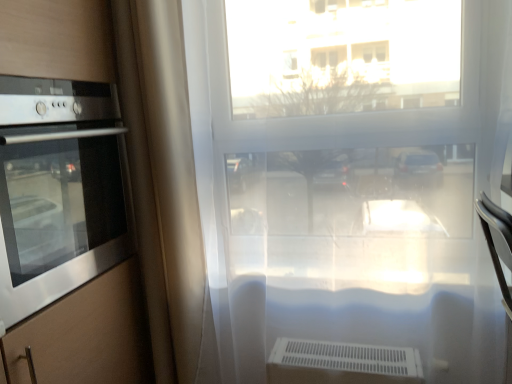
Question: Does beige fabric curtain at left have a greater height compared to stainless steel oven at left?

Choices:
 (A) no
 (B) yes

Answer: (B)

Question: Considering the relative sizes of beige fabric curtain at left and stainless steel oven at left in the image provided, is beige fabric curtain at left bigger than stainless steel oven at left?

Choices:
 (A) no
 (B) yes

Answer: (A)

Question: Is stainless steel oven at left surrounded by beige fabric curtain at left?

Choices:
 (A) no
 (B) yes

Answer: (A)

Question: Is stainless steel oven at left at the back of beige fabric curtain at left?

Choices:
 (A) no
 (B) yes

Answer: (A)

Question: Does beige fabric curtain at left have a greater width compared to stainless steel oven at left?

Choices:
 (A) no
 (B) yes

Answer: (A)

Question: Based on their sizes in the image, would you say transparent plastic window at center is bigger or smaller than beige fabric curtain at left?

Choices:
 (A) small
 (B) big

Answer: (B)

Question: Is point (237, 34) closer or farther from the camera than point (150, 104)?

Choices:
 (A) farther
 (B) closer

Answer: (A)

Question: From the image's perspective, is transparent plastic window at center located above or below beige fabric curtain at left?

Choices:
 (A) above
 (B) below

Answer: (B)

Question: In the image, is transparent plastic window at center positioned in front of or behind beige fabric curtain at left?

Choices:
 (A) front
 (B) behind

Answer: (A)

Question: Looking at the image, does beige fabric curtain at left seem bigger or smaller compared to transparent plastic window at center?

Choices:
 (A) small
 (B) big

Answer: (A)

Question: In the image, is beige fabric curtain at left on the left side or the right side of transparent plastic window at center?

Choices:
 (A) right
 (B) left

Answer: (B)

Question: In the image, is beige fabric curtain at left positioned in front of or behind transparent plastic window at center?

Choices:
 (A) front
 (B) behind

Answer: (B)

Question: Looking at their shapes, would you say beige fabric curtain at left is wider or thinner than transparent plastic window at center?

Choices:
 (A) thin
 (B) wide

Answer: (A)

Question: In terms of size, does stainless steel oven at left appear bigger or smaller than transparent plastic window at center?

Choices:
 (A) big
 (B) small

Answer: (B)

Question: From a real-world perspective, is stainless steel oven at left physically located above or below transparent plastic window at center?

Choices:
 (A) below
 (B) above

Answer: (B)